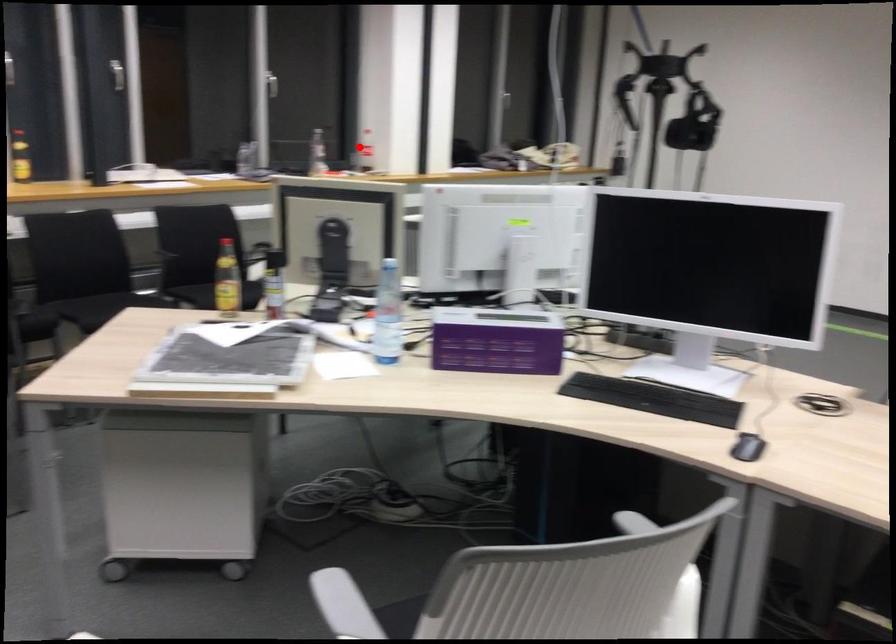
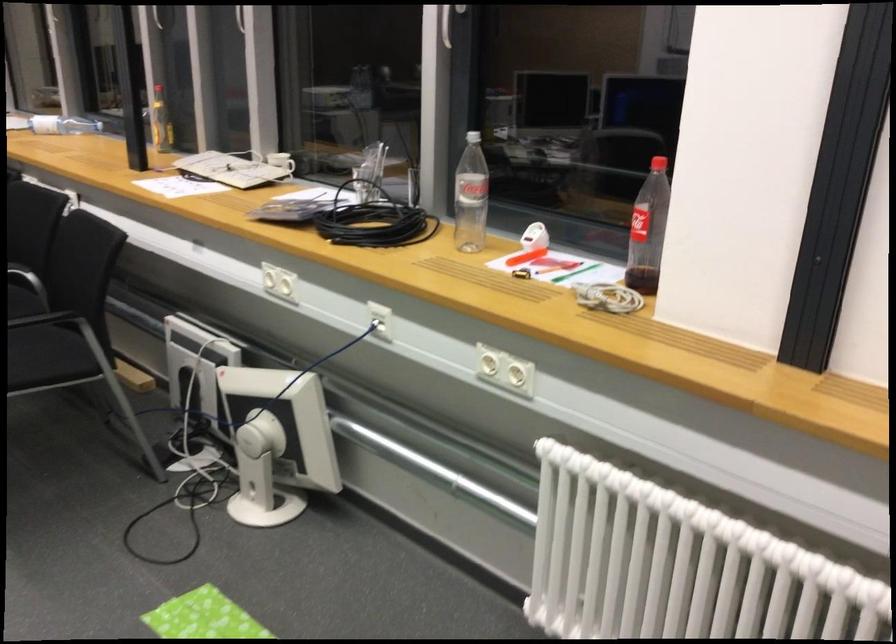
Find the pixel in the second image that matches the highlighted location in the first image.

(648, 230)